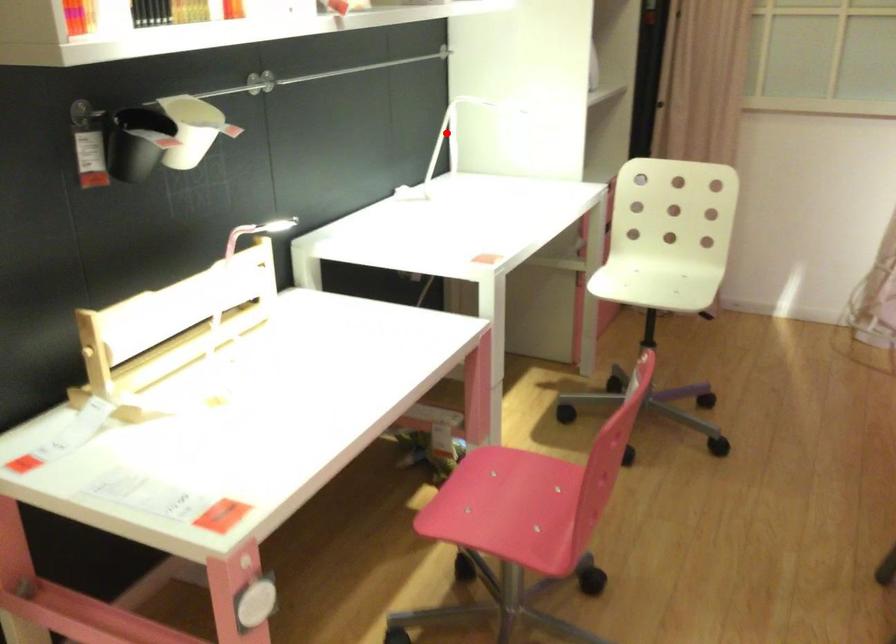
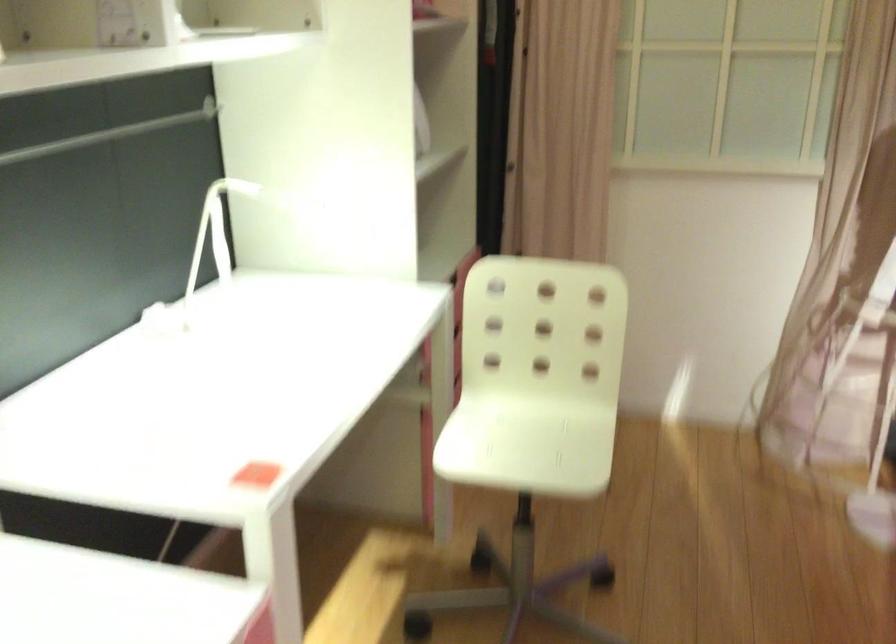
Question: I am providing you with two images of the same scene from different viewpoints. A red point is shown in image1. For the corresponding object point in image2, is it positioned nearer or farther from the camera?

Choices:
 (A) Nearer
 (B) Farther

Answer: (A)